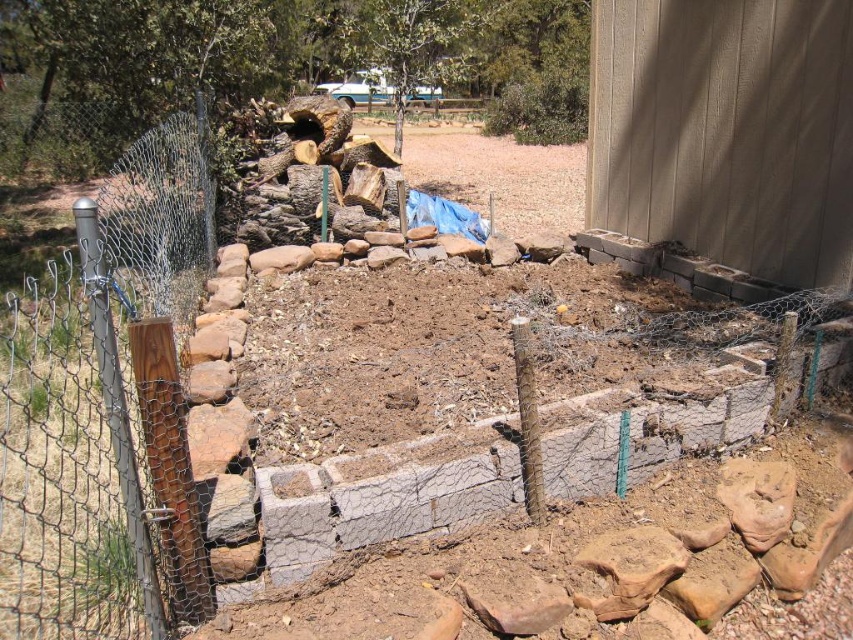
Question: Can you confirm if brown wooden post at left is smaller than brown soil at center?

Choices:
 (A) yes
 (B) no

Answer: (A)

Question: Does brown wooden post at left appear over brown soil at center?

Choices:
 (A) yes
 (B) no

Answer: (B)

Question: Is brown wooden post at left positioned before brown soil at center?

Choices:
 (A) no
 (B) yes

Answer: (B)

Question: Among these objects, which one is nearest to the camera?

Choices:
 (A) brown wooden post at left
 (B) brown soil at center

Answer: (A)

Question: Which of the following is the farthest from the observer?

Choices:
 (A) brown soil at center
 (B) brown wooden post at left

Answer: (A)

Question: Among these objects, which one is nearest to the camera?

Choices:
 (A) brown soil at center
 (B) brown wooden post at left

Answer: (B)